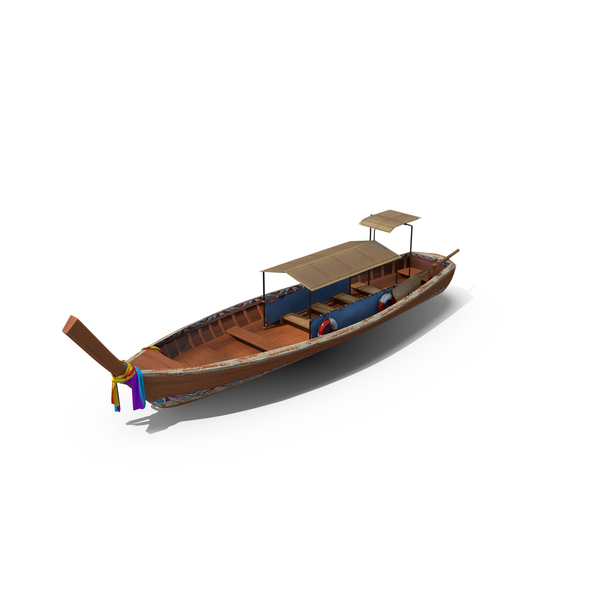
At what (x,y) coordinates should I click in order to perform the action: click on seats. Please return your answer as a coordinate pair (x, y). The height and width of the screenshot is (600, 600). Looking at the image, I should click on (301, 319), (320, 311), (343, 301), (370, 292).